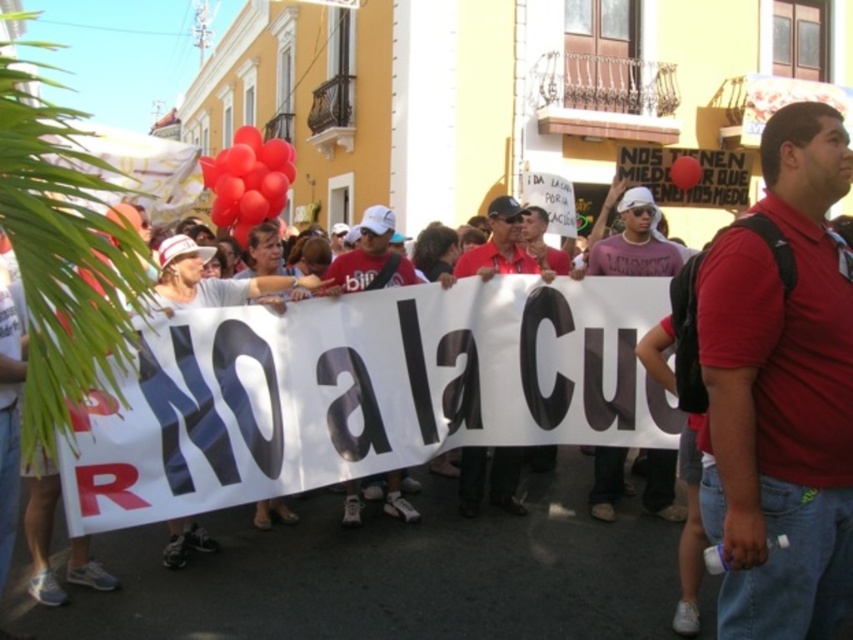
Can you confirm if red shirt at center is positioned below matte red shirt at center?

Yes, red shirt at center is below matte red shirt at center.

Does red shirt at center have a greater height compared to matte red shirt at center?

Yes.

Is point (529, 262) positioned behind point (387, 230)?

Yes, point (529, 262) is behind point (387, 230).

The width and height of the screenshot is (853, 640). Find the location of `red shirt at center`. red shirt at center is located at coordinates (502, 246).

Does red cotton shirt at center appear under rubber heart balloons at upper center?

Indeed, red cotton shirt at center is positioned under rubber heart balloons at upper center.

Can you confirm if red cotton shirt at center is taller than rubber heart balloons at upper center?

In fact, red cotton shirt at center may be shorter than rubber heart balloons at upper center.

Does point (704, 384) come closer to viewer compared to point (242, 228)?

Yes, point (704, 384) is in front of point (242, 228).

Where is `red cotton shirt at center`? This screenshot has height=640, width=853. red cotton shirt at center is located at coordinates (781, 392).

Is point (755, 317) farther from camera compared to point (370, 232)?

No, it is not.

Does point (741, 412) come in front of point (389, 477)?

Yes, point (741, 412) is in front of point (389, 477).

Between point (732, 483) and point (381, 476), which one is positioned behind?

Positioned behind is point (381, 476).

What are the coordinates of `red cotton shirt at center` in the screenshot? It's located at (781, 392).